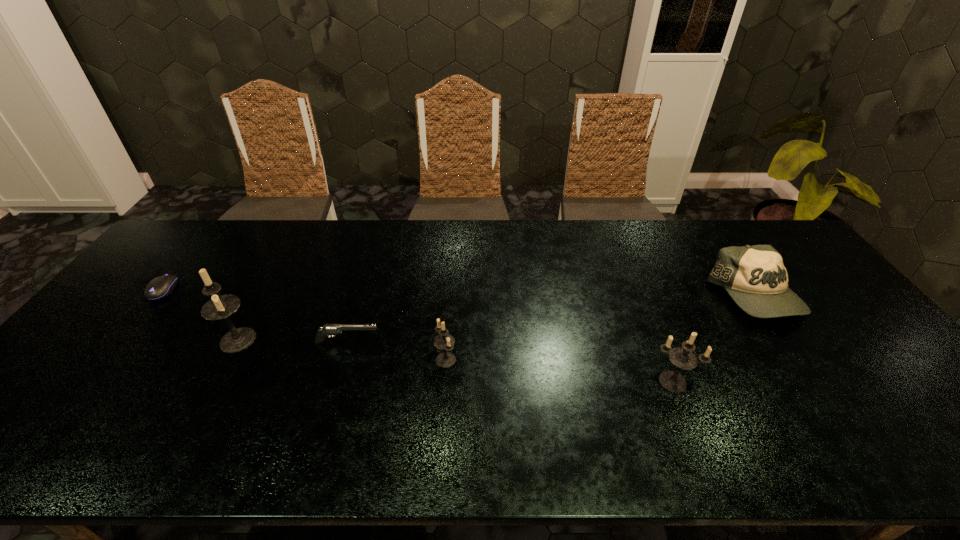
Identify the location of unoccupied area between the third object from left to right and the second object from right to left. Image resolution: width=960 pixels, height=540 pixels. (510, 362).

The image size is (960, 540). What are the coordinates of `empty space between the shortest candle holder and the second shortest object` in the screenshot? It's located at (x=396, y=351).

Where is `free spot between the fifth tallest object and the rightmost candle holder`? Image resolution: width=960 pixels, height=540 pixels. free spot between the fifth tallest object and the rightmost candle holder is located at coordinates (510, 362).

The height and width of the screenshot is (540, 960). What are the coordinates of `vacant space in between the computer mouse and the baseball cap` in the screenshot? It's located at (459, 293).

Find the location of a particular element. vacant space that is in between the shortest candle holder and the second object from right to left is located at coordinates (560, 370).

Where is `vacant space that's between the leftmost candle holder and the rightmost object`? vacant space that's between the leftmost candle holder and the rightmost object is located at coordinates (496, 318).

This screenshot has height=540, width=960. What are the coordinates of `vacant point located between the leftmost object and the shortest candle holder` in the screenshot? It's located at (304, 325).

Identify the location of object that is the fourth closest one to the shortest candle holder. Image resolution: width=960 pixels, height=540 pixels. (755, 278).

Where is `object that is the fifth closest to the leftmost object`? object that is the fifth closest to the leftmost object is located at coordinates (755, 278).

Locate which candle holder is the second closest to the rightmost object. Please provide its 2D coordinates. Your answer should be formatted as a tuple, i.e. [(x, y)], where the tuple contains the x and y coordinates of a point satisfying the conditions above.

[(444, 341)]